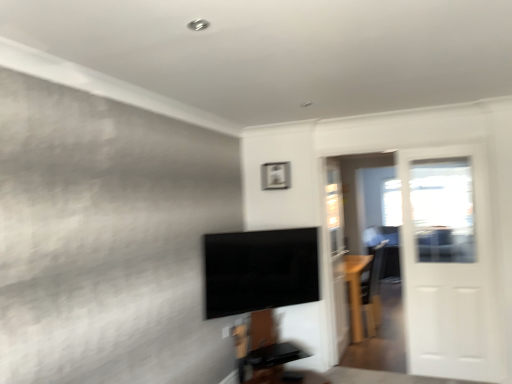
The width and height of the screenshot is (512, 384). I want to click on matte silver picture frame at upper center, so click(275, 175).

Is there a large distance between black glossy tv at center and matte silver picture frame at upper center?

No, black glossy tv at center is not far from matte silver picture frame at upper center.

Considering the relative positions of black glossy tv at center and matte silver picture frame at upper center in the image provided, is black glossy tv at center to the left of matte silver picture frame at upper center from the viewer's perspective?

Yes, black glossy tv at center is to the left of matte silver picture frame at upper center.

Can you confirm if black glossy tv at center is smaller than matte silver picture frame at upper center?

Incorrect, black glossy tv at center is not smaller in size than matte silver picture frame at upper center.

Find the location of `picture frame above the black glossy tv at center (from a real-world perspective)`. picture frame above the black glossy tv at center (from a real-world perspective) is located at coordinates (275, 175).

Does matte silver picture frame at upper center lie in front of black glossy tv at center?

No, it is not.

From a real-world perspective, is matte silver picture frame at upper center positioned over black glossy tv at center based on gravity?

Yes, from a real-world perspective, matte silver picture frame at upper center is above black glossy tv at center.

Does matte silver picture frame at upper center turn towards black glossy tv at center?

No, matte silver picture frame at upper center is not aimed at black glossy tv at center.

Is light brown wood table at right taller or shorter than white glossy door at right?

Considering their sizes, light brown wood table at right has less height than white glossy door at right.

Would you say light brown wood table at right is outside white glossy door at right?

light brown wood table at right lies outside white glossy door at right's area.

Considering the relative sizes of light brown wood table at right and white glossy door at right in the image provided, is light brown wood table at right bigger than white glossy door at right?

Indeed, light brown wood table at right has a larger size compared to white glossy door at right.

Between light brown wood table at right and white glossy door at right, which one has larger width?

light brown wood table at right is wider.

Considering the sizes of objects light brown wood table at right and matte silver picture frame at upper center in the image provided, who is smaller, light brown wood table at right or matte silver picture frame at upper center?

Answer: matte silver picture frame at upper center is smaller.

Considering the relative positions of light brown wood table at right and matte silver picture frame at upper center in the image provided, is light brown wood table at right to the left of matte silver picture frame at upper center from the viewer's perspective?

Incorrect, light brown wood table at right is not on the left side of matte silver picture frame at upper center.

How many degrees apart are the facing directions of light brown wood table at right and matte silver picture frame at upper center?

There is a 90.2-degree angle between the facing directions of light brown wood table at right and matte silver picture frame at upper center.

From the image's perspective, which one is positioned higher, light brown wood table at right or matte silver picture frame at upper center?

matte silver picture frame at upper center appears higher in the image.

In the scene shown: Based on their sizes in the image, would you say matte silver picture frame at upper center is bigger or smaller than white glossy door at right?

Clearly, matte silver picture frame at upper center is smaller in size than white glossy door at right.

How many degrees apart are the facing directions of matte silver picture frame at upper center and white glossy door at right?

They differ by 0.00193 degrees in their facing directions.

Considering the relative sizes of matte silver picture frame at upper center and white glossy door at right in the image provided, is matte silver picture frame at upper center shorter than white glossy door at right?

Yes, matte silver picture frame at upper center is shorter than white glossy door at right.

Is white glossy door at right directly adjacent to light brown wood table at right?

No, white glossy door at right is not touching light brown wood table at right.

The width and height of the screenshot is (512, 384). In order to click on furniture behind the white glossy door at right in this screenshot , I will do `click(355, 291)`.

From a real-world perspective, is white glossy door at right physically located above or below light brown wood table at right?

From a real-world perspective, white glossy door at right is physically above light brown wood table at right.

Is white glossy door at right shorter than light brown wood table at right?

No, white glossy door at right is not shorter than light brown wood table at right.

Considering the positions of objects black glossy tv at center and white glossy door at right in the image provided, who is more to the left, black glossy tv at center or white glossy door at right?

black glossy tv at center.

Is black glossy tv at center shorter than white glossy door at right?

Yes.

In the scene shown: Can white glossy door at right be found inside black glossy tv at center?

No, white glossy door at right is not surrounded by black glossy tv at center.

Find the location of `television on the left side of matte silver picture frame at upper center`. television on the left side of matte silver picture frame at upper center is located at coordinates 260,270.

Identify the location of picture frame to the right of black glossy tv at center. (275, 175).

Considering their positions, is light brown wood table at right positioned further to white glossy door at right than matte silver picture frame at upper center?

Based on the image, matte silver picture frame at upper center appears to be further to white glossy door at right.

When comparing their distances from matte silver picture frame at upper center, does light brown wood table at right or white glossy door at right seem closer?

The object closer to matte silver picture frame at upper center is light brown wood table at right.

Based on their spatial positions, is black glossy tv at center or light brown wood table at right closer to matte silver picture frame at upper center?

The object closer to matte silver picture frame at upper center is black glossy tv at center.

Based on their spatial positions, is black glossy tv at center or white glossy door at right closer to light brown wood table at right?

Based on the image, white glossy door at right appears to be nearer to light brown wood table at right.

Based on their spatial positions, is light brown wood table at right or white glossy door at right further from black glossy tv at center?

Based on the image, white glossy door at right appears to be further to black glossy tv at center.

Based on their spatial positions, is light brown wood table at right or matte silver picture frame at upper center further from black glossy tv at center?

Based on the image, light brown wood table at right appears to be further to black glossy tv at center.

Which object lies nearer to the anchor point matte silver picture frame at upper center, black glossy tv at center or white glossy door at right?

Among the two, black glossy tv at center is located nearer to matte silver picture frame at upper center.

Based on their spatial positions, is black glossy tv at center or matte silver picture frame at upper center closer to light brown wood table at right?

black glossy tv at center is positioned closer to the anchor light brown wood table at right.

Where is `picture frame between black glossy tv at center and light brown wood table at right along the z-axis`? Image resolution: width=512 pixels, height=384 pixels. picture frame between black glossy tv at center and light brown wood table at right along the z-axis is located at coordinates (275, 175).

Identify the location of furniture located between matte silver picture frame at upper center and white glossy door at right in the left-right direction. This screenshot has width=512, height=384. (355, 291).

Locate an element on the screen. The image size is (512, 384). picture frame between black glossy tv at center and white glossy door at right from left to right is located at coordinates (275, 175).

Where is `screen door between black glossy tv at center and light brown wood table at right in the front-back direction`? The image size is (512, 384). screen door between black glossy tv at center and light brown wood table at right in the front-back direction is located at coordinates (447, 263).